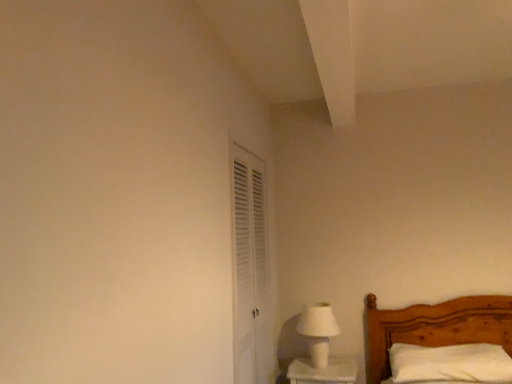
Question: From the image's perspective, is white matte table lamp at lower right located above or below white soft pillow at lower right?

Choices:
 (A) above
 (B) below

Answer: (A)

Question: Is white matte table lamp at lower right wider or thinner than white soft pillow at lower right?

Choices:
 (A) thin
 (B) wide

Answer: (A)

Question: Estimate the real-world distances between objects in this image. Which object is farther from the white soft pillow at lower right?

Choices:
 (A) white louvered door at center-left
 (B) white matte table lamp at lower right

Answer: (A)

Question: Which of these objects is positioned closest to the white louvered door at center-left?

Choices:
 (A) white matte table lamp at lower right
 (B) white soft pillow at lower right

Answer: (A)